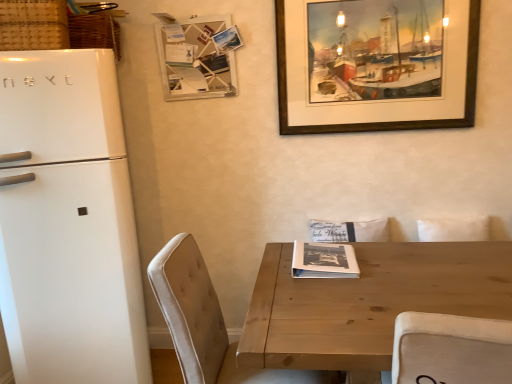
Question: From the image's perspective, would you say black paper magazine at center is positioned over wooden picture frame at upper right?

Choices:
 (A) yes
 (B) no

Answer: (B)

Question: Can you confirm if black paper magazine at center is smaller than wooden picture frame at upper right?

Choices:
 (A) yes
 (B) no

Answer: (A)

Question: Can you confirm if black paper magazine at center is shorter than wooden picture frame at upper right?

Choices:
 (A) yes
 (B) no

Answer: (A)

Question: Is black paper magazine at center thinner than wooden picture frame at upper right?

Choices:
 (A) yes
 (B) no

Answer: (B)

Question: From a real-world perspective, does black paper magazine at center stand above wooden picture frame at upper right?

Choices:
 (A) yes
 (B) no

Answer: (B)

Question: Can you confirm if black paper magazine at center is positioned to the left of wooden picture frame at upper right?

Choices:
 (A) yes
 (B) no

Answer: (A)

Question: Considering the relative sizes of wooden memo board at upper center and black paper magazine at center in the image provided, is wooden memo board at upper center shorter than black paper magazine at center?

Choices:
 (A) yes
 (B) no

Answer: (B)

Question: Is the position of wooden memo board at upper center more distant than that of black paper magazine at center?

Choices:
 (A) yes
 (B) no

Answer: (A)

Question: Is wooden memo board at upper center at the right side of black paper magazine at center?

Choices:
 (A) yes
 (B) no

Answer: (B)

Question: Does wooden memo board at upper center have a greater height compared to black paper magazine at center?

Choices:
 (A) no
 (B) yes

Answer: (B)

Question: From the image's perspective, is wooden memo board at upper center over black paper magazine at center?

Choices:
 (A) no
 (B) yes

Answer: (B)

Question: Could you tell me if wooden memo board at upper center is turned towards black paper magazine at center?

Choices:
 (A) yes
 (B) no

Answer: (B)

Question: Is beige fabric chair at lower left not within black paper magazine at center?

Choices:
 (A) no
 (B) yes

Answer: (B)